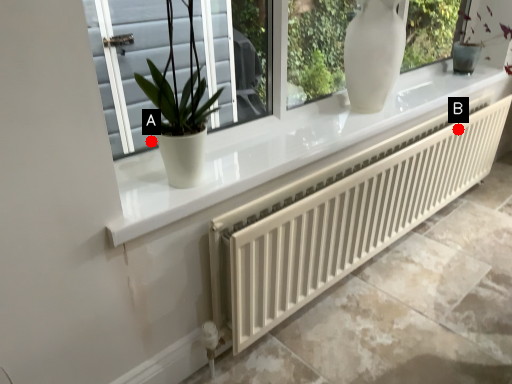
Question: Two points are circled on the image, labeled by A and B beside each circle. Which point appears farthest from the camera in this image?

Choices:
 (A) A is further
 (B) B is further

Answer: (A)